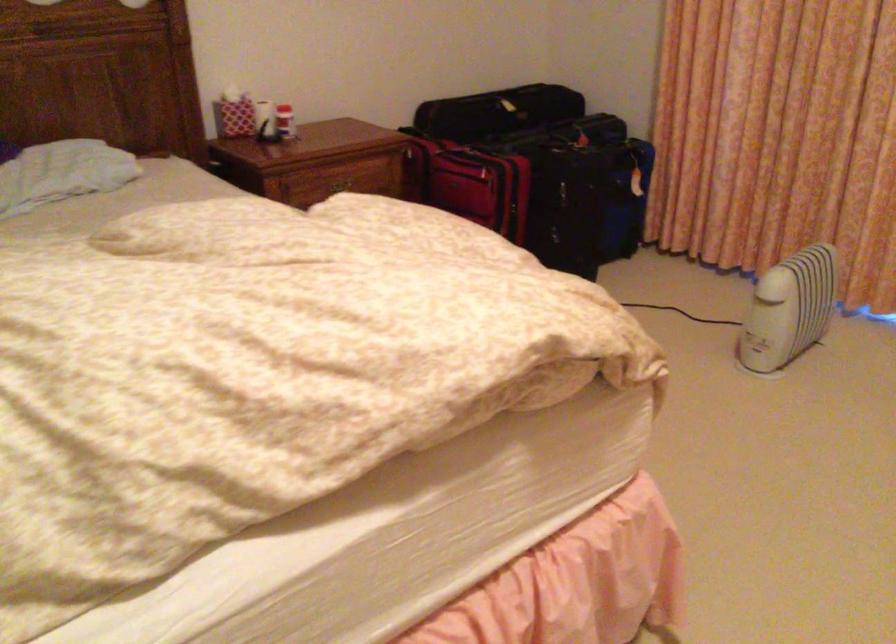
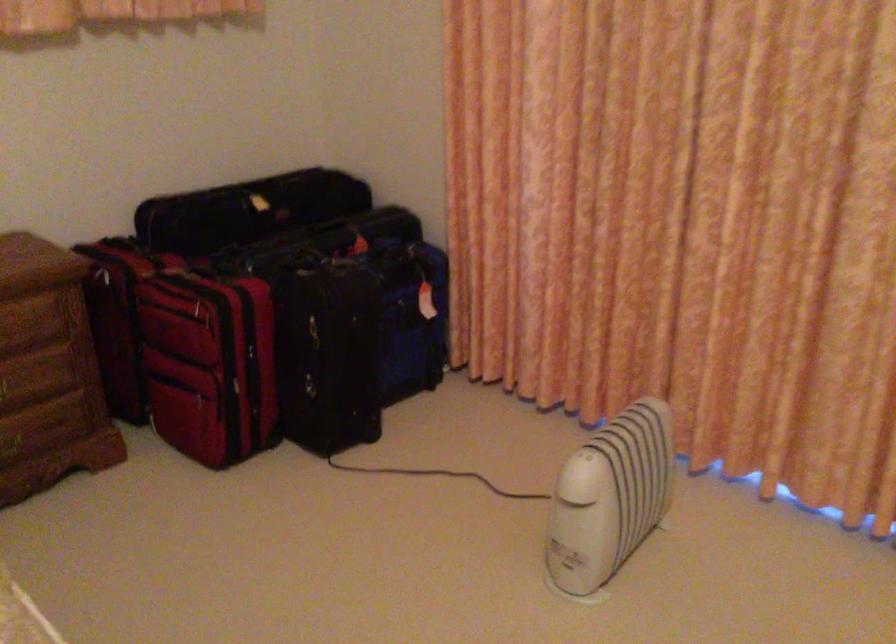
Where in the second image is the point corresponding to (794,292) from the first image?

(609, 498)